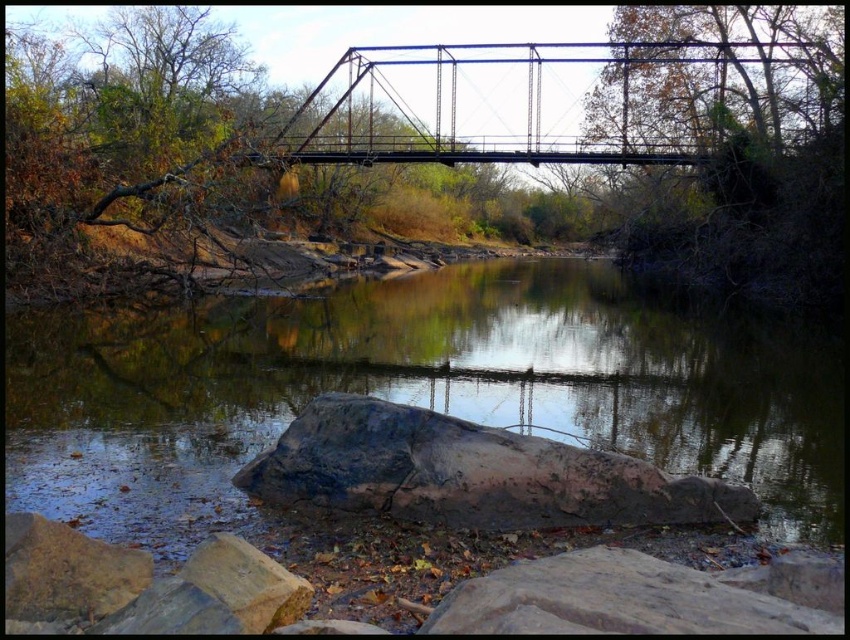
Question: Can you confirm if smooth brown water at center is thinner than gray rough rock at lower center?

Choices:
 (A) yes
 (B) no

Answer: (B)

Question: Which of these objects is positioned farthest from the metallic bridge at upper center?

Choices:
 (A) gray rough rock at lower center
 (B) smooth brown water at center

Answer: (A)

Question: Can you confirm if metallic bridge at upper center is thinner than gray rough rock at lower center?

Choices:
 (A) no
 (B) yes

Answer: (A)

Question: Can you confirm if smooth brown water at center is wider than gray rough rock at lower center?

Choices:
 (A) yes
 (B) no

Answer: (A)

Question: Among these points, which one is farthest from the camera?

Choices:
 (A) [684, 49]
 (B) [459, 468]

Answer: (A)

Question: Which of the following is the closest to the observer?

Choices:
 (A) (429, 483)
 (B) (330, 81)
 (C) (706, 323)

Answer: (A)